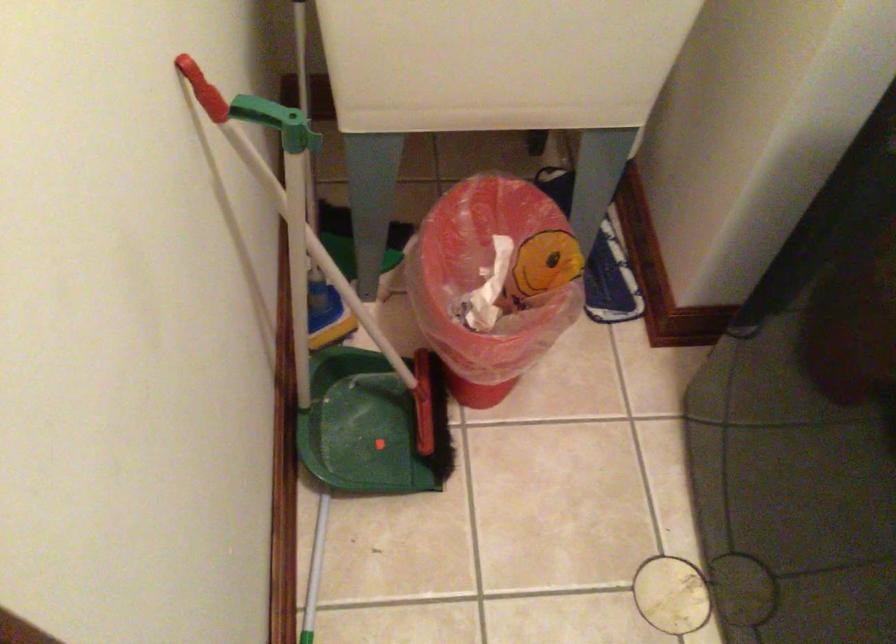
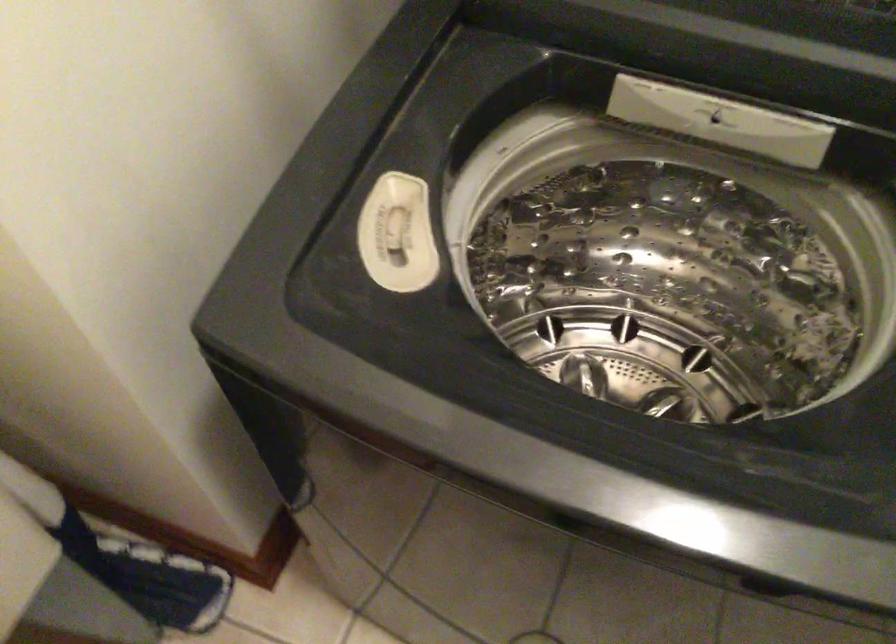
Question: The camera is either moving clockwise (left) or counter-clockwise (right) around the object. The first image is from the beginning of the video and the second image is from the end. Is the camera moving left or right when shooting the video?

Choices:
 (A) Left
 (B) Right

Answer: (A)